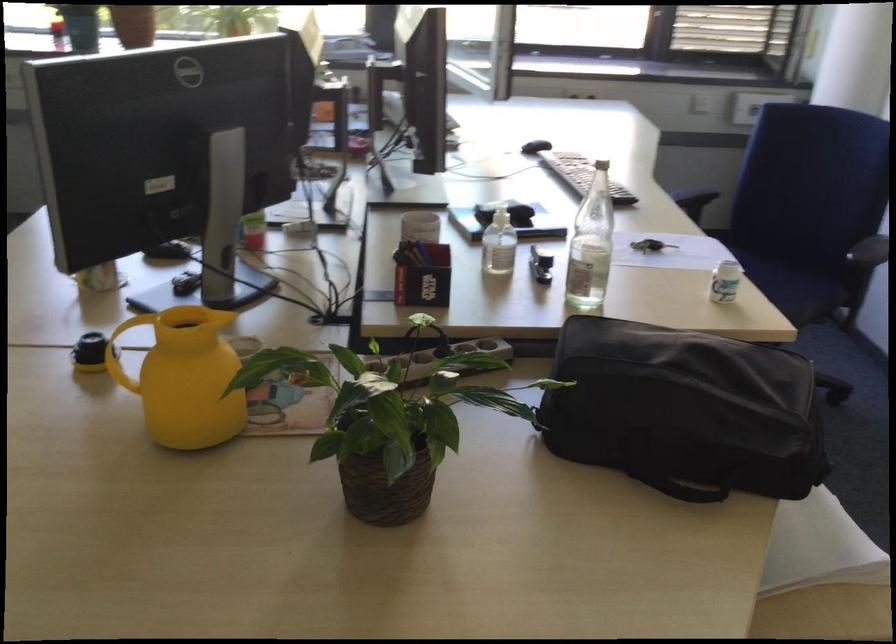
This screenshot has height=644, width=896. Find the location of `chair sitting surface`. chair sitting surface is located at coordinates (787, 286).